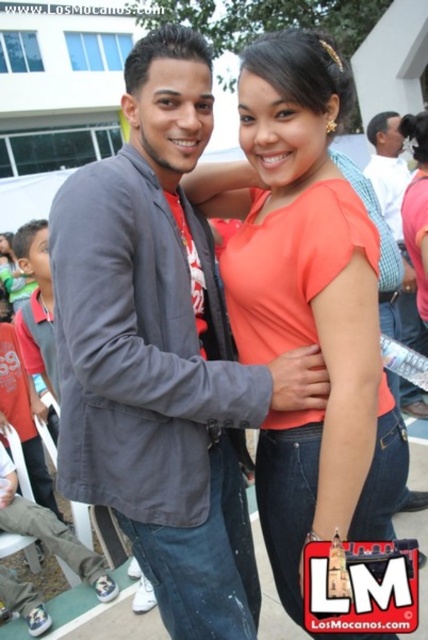
Which is behind, point (276, 321) or point (394, 173)?

The point (394, 173) is more distant.

I want to click on matte orange blouse at center, so click(306, 304).

Where is `matte orange blouse at center`? The width and height of the screenshot is (428, 640). matte orange blouse at center is located at coordinates (306, 304).

Between matte gray blazer at center and matte orange blouse at center, which one is positioned lower?

matte gray blazer at center is lower down.

Based on the photo, does matte gray blazer at center appear on the left side of matte orange blouse at center?

Yes, matte gray blazer at center is to the left of matte orange blouse at center.

Is point (187, 225) farther from camera compared to point (309, 312)?

Yes, point (187, 225) is behind point (309, 312).

At what (x,y) coordinates should I click in order to perform the action: click on matte gray blazer at center. Please return your answer as a coordinate pair (x, y). This screenshot has width=428, height=640. Looking at the image, I should click on (163, 353).

Measure the distance between matte gray blazer at center and camera.

matte gray blazer at center is 4.17 feet from camera.

In order to click on matte gray blazer at center in this screenshot , I will do `click(163, 353)`.